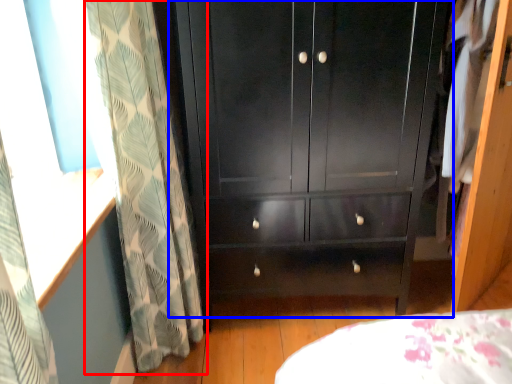
Question: Which object appears closest to the camera in this image, curtain (highlighted by a red box) or cupboard (highlighted by a blue box)?

Choices:
 (A) curtain
 (B) cupboard

Answer: (A)